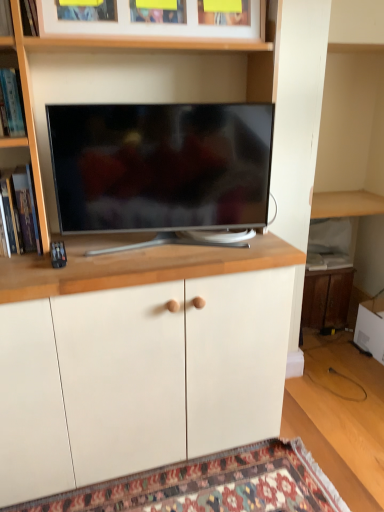
I want to click on vacant space in front of hardcover book at left, so click(31, 262).